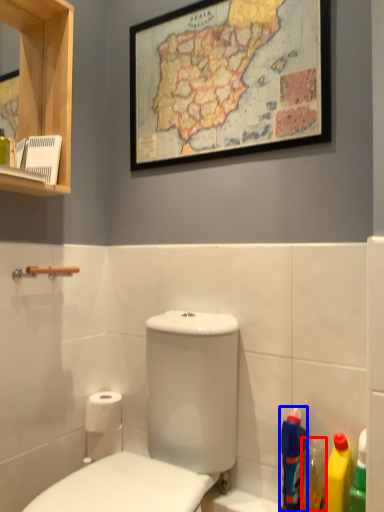
Question: Which object is further to the camera taking this photo, cleaning product (highlighted by a red box) or cleaning product (highlighted by a blue box)?

Choices:
 (A) cleaning product
 (B) cleaning product

Answer: (B)